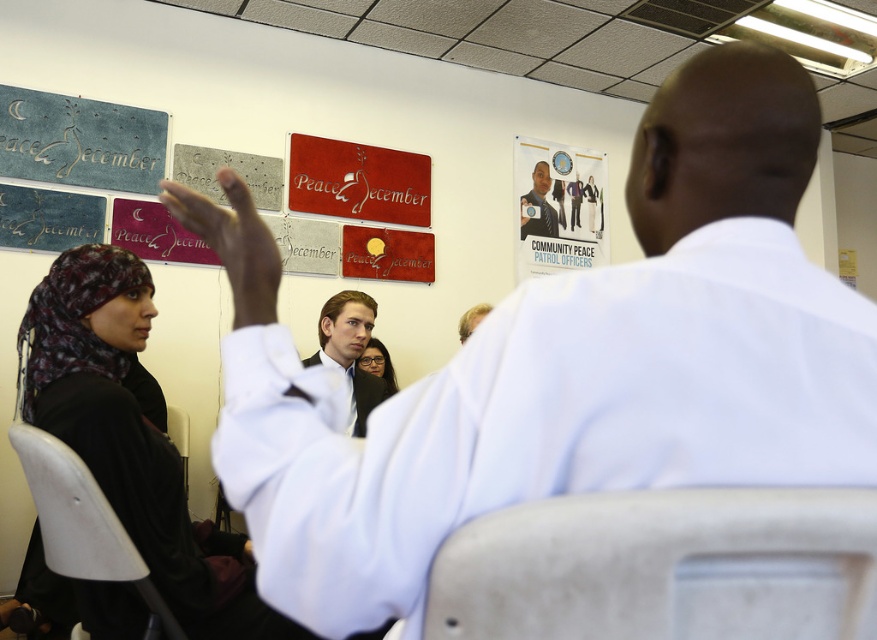
Which of these two, matte black glasses at center or light brown hair at center, stands taller?

Standing taller between the two is matte black glasses at center.

Describe the element at coordinates (378, 364) in the screenshot. The image size is (877, 640). I see `matte black glasses at center` at that location.

Does point (384, 346) come closer to viewer compared to point (472, 316)?

No, (384, 346) is behind (472, 316).

Locate an element on the screen. Image resolution: width=877 pixels, height=640 pixels. matte black glasses at center is located at coordinates (378, 364).

Does matte black hand at upper center appear on the left side of light brown shirt at center?

In fact, matte black hand at upper center is to the right of light brown shirt at center.

Which of these two, matte black hand at upper center or light brown shirt at center, stands shorter?

With less height is matte black hand at upper center.

Does point (182, 211) lie behind point (353, 321)?

That is False.

At what (x,y) coordinates should I click in order to perform the action: click on matte black hand at upper center. Please return your answer as a coordinate pair (x, y). The image size is (877, 640). Looking at the image, I should click on (233, 243).

Which is behind, point (153, 307) or point (322, 346)?

Point (322, 346)

The height and width of the screenshot is (640, 877). Find the location of `black fabric hijab at left`. black fabric hijab at left is located at coordinates (123, 422).